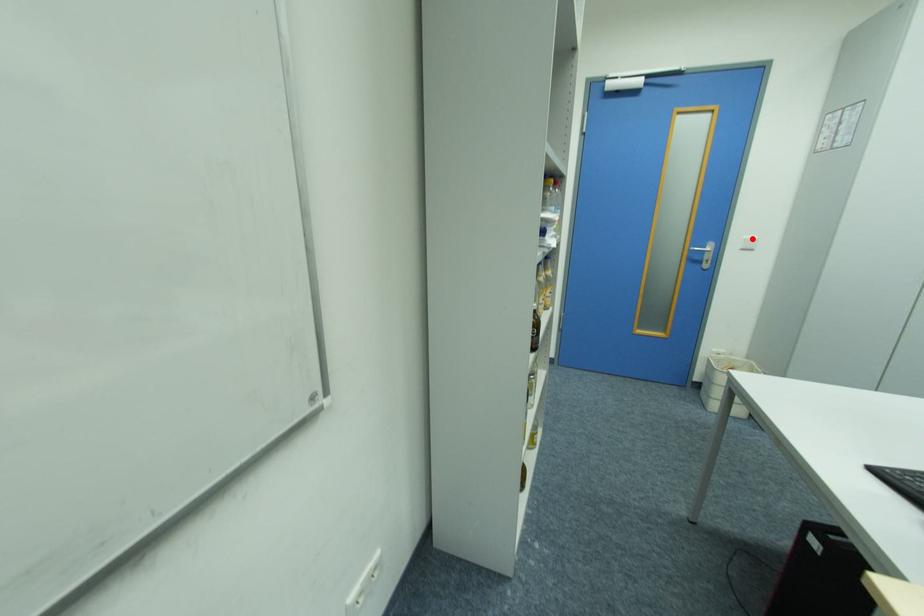
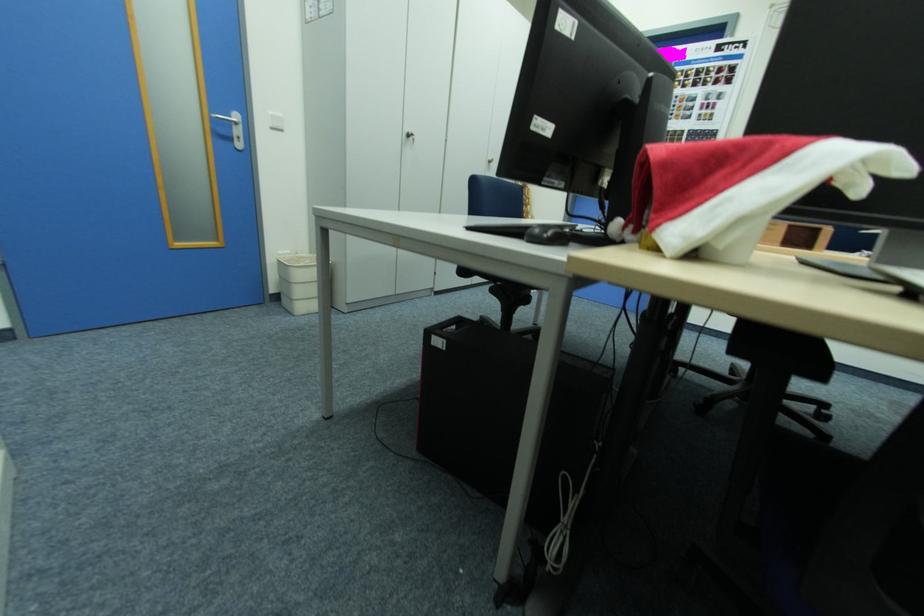
In the second image, find the point that corresponds to the highlighted location in the first image.

(277, 114)